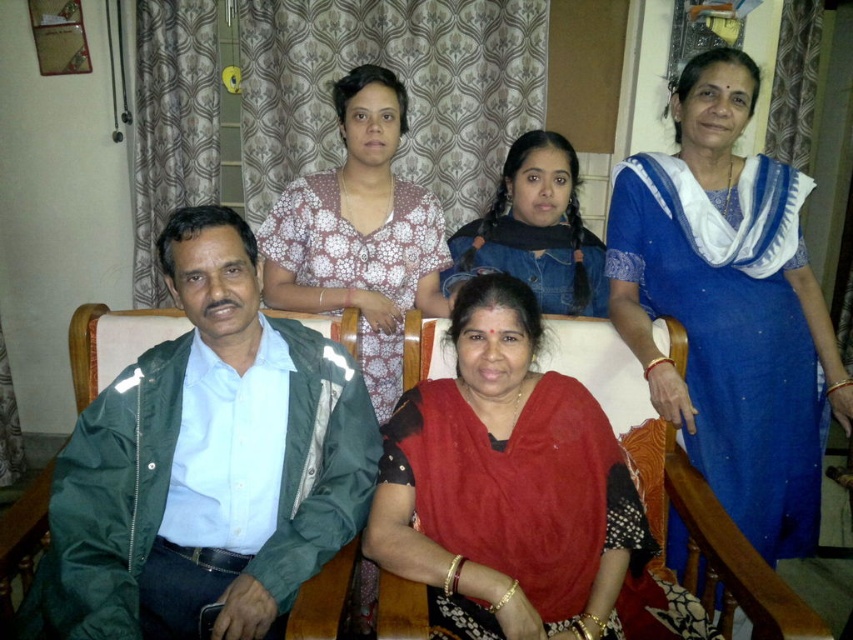
Where is `white dotted blouse at upper center`? The image size is (853, 640). white dotted blouse at upper center is located at coordinates (360, 234).

Is white dotted blouse at upper center further to camera compared to denim jacket at center?

No, white dotted blouse at upper center is closer to the viewer.

The width and height of the screenshot is (853, 640). What do you see at coordinates (360, 234) in the screenshot?
I see `white dotted blouse at upper center` at bounding box center [360, 234].

Where is `white dotted blouse at upper center`? Image resolution: width=853 pixels, height=640 pixels. white dotted blouse at upper center is located at coordinates [x=360, y=234].

Does blue silk saree at upper right have a lesser width compared to white dotted blouse at upper center?

Incorrect, blue silk saree at upper right's width is not less than white dotted blouse at upper center's.

Measure the distance between blue silk saree at upper right and camera.

blue silk saree at upper right and camera are 1.62 meters apart.

Identify the location of blue silk saree at upper right. 729,307.

Can you confirm if red silk saree at center is shorter than white dotted blouse at upper center?

Correct, red silk saree at center is not as tall as white dotted blouse at upper center.

Which is more to the right, red silk saree at center or white dotted blouse at upper center?

red silk saree at center

Which is behind, point (639, 525) or point (416, 198)?

The point (416, 198) is behind.

Find the location of a particular element. red silk saree at center is located at coordinates (508, 484).